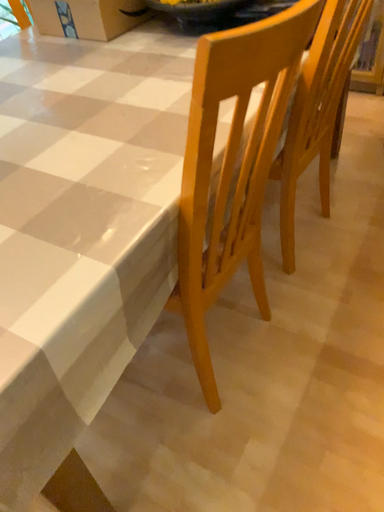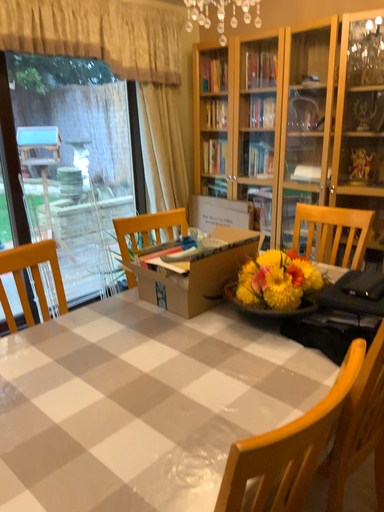
Question: How did the camera likely rotate when shooting the video?

Choices:
 (A) rotated right
 (B) rotated left

Answer: (B)